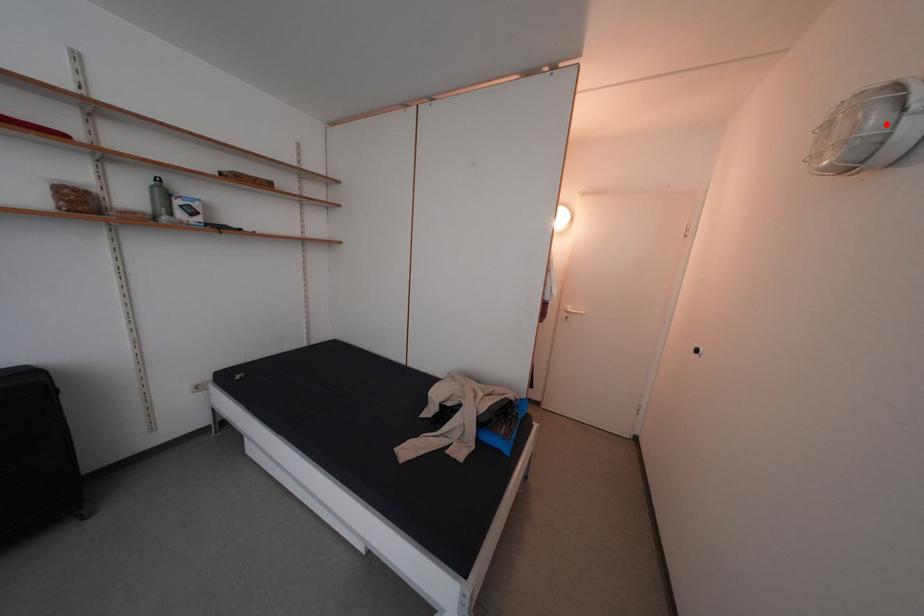
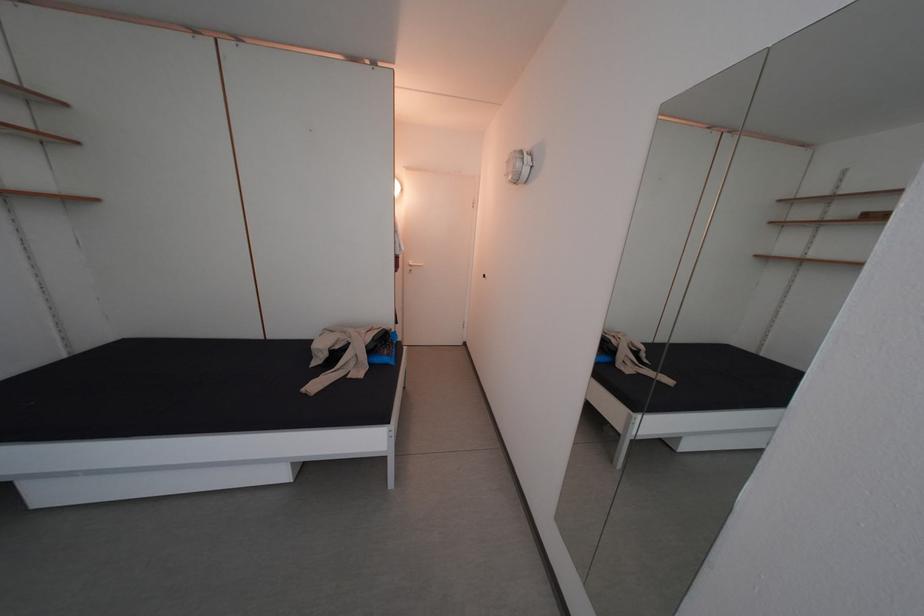
The point at the highlighted location is marked in the first image. Where is the corresponding point in the second image?

(528, 169)